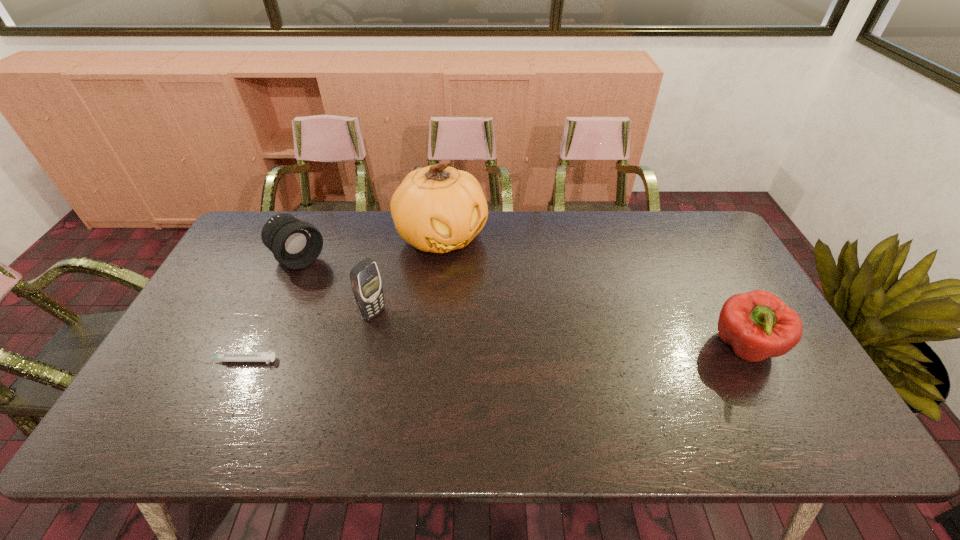
Locate an element on the screen. This screenshot has height=540, width=960. the fourth closest object relative to the syringe is located at coordinates (758, 325).

Identify the location of the second closest object to the cellular telephone. The image size is (960, 540). (296, 244).

In order to click on blank space that satisfies the following two spatial constraints: 1. on the front side of the telephoto lens; 2. on the right side of the cellular telephone in this screenshot , I will do `click(275, 313)`.

Where is `free spot that satisfies the following two spatial constraints: 1. on the front side of the telephoto lens; 2. on the right side of the bell pepper`? This screenshot has width=960, height=540. free spot that satisfies the following two spatial constraints: 1. on the front side of the telephoto lens; 2. on the right side of the bell pepper is located at coordinates (259, 348).